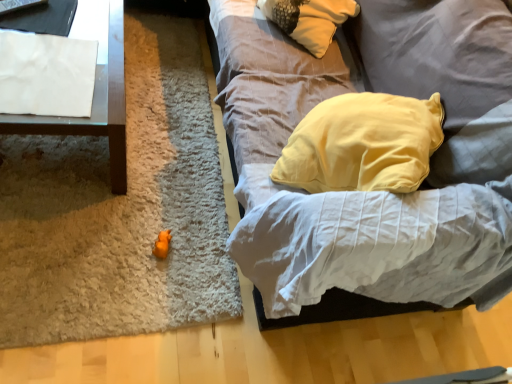
This screenshot has height=384, width=512. I want to click on free space on the front side of orange rubber duck at center, so click(143, 286).